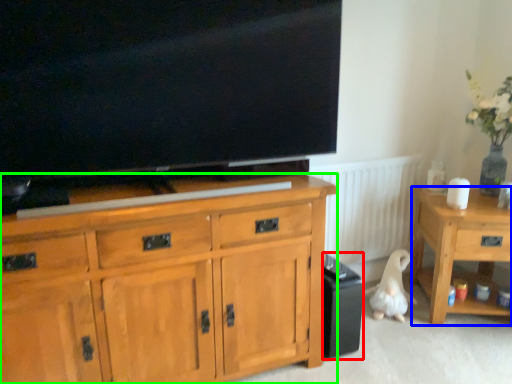
Question: Which object is positioned closest to loudspeaker (highlighted by a red box)? Select from desk (highlighted by a blue box) and cabinetry (highlighted by a green box).

Choices:
 (A) desk
 (B) cabinetry

Answer: (A)